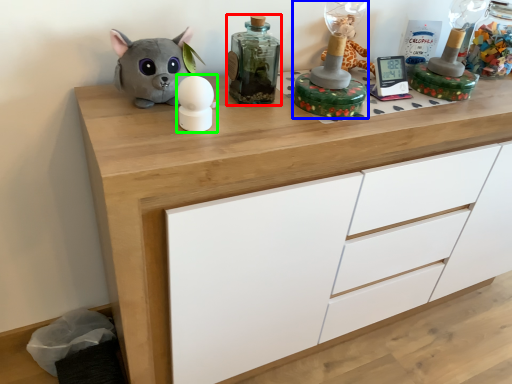
Question: Which object is the closest to the bottle (highlighted by a red box)? Choose among these: toy (highlighted by a blue box) or toy (highlighted by a green box).

Choices:
 (A) toy
 (B) toy

Answer: (A)